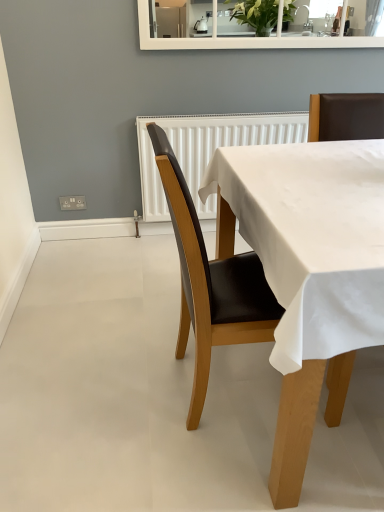
This screenshot has width=384, height=512. I want to click on black leather chair at center, so click(211, 283).

This screenshot has height=512, width=384. Describe the element at coordinates (211, 283) in the screenshot. I see `black leather chair at center` at that location.

Where is `black leather chair at center`? black leather chair at center is located at coordinates (211, 283).